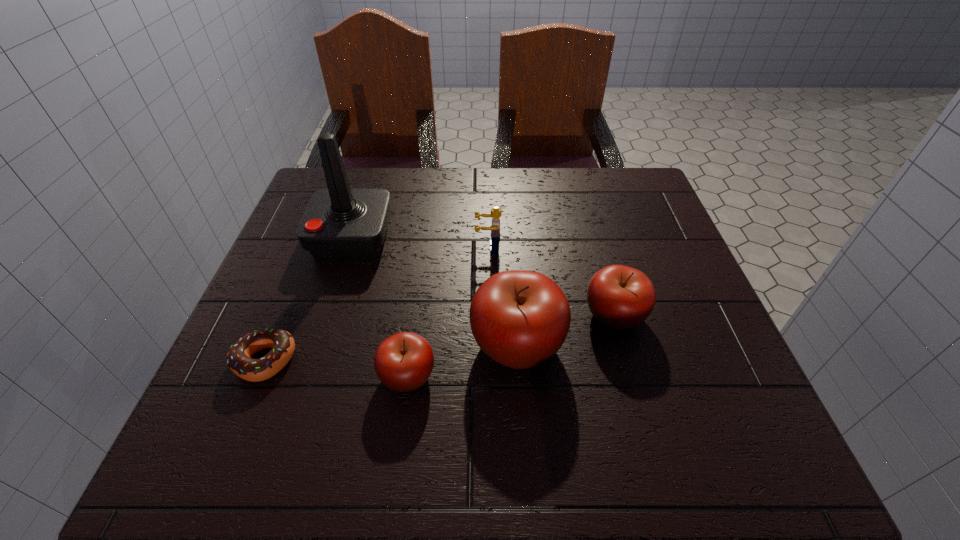
Image resolution: width=960 pixels, height=540 pixels. Find the location of `free space that is in between the doughnut and the joystick`. free space that is in between the doughnut and the joystick is located at coordinates pyautogui.click(x=308, y=299).

This screenshot has width=960, height=540. What are the coordinates of `free space between the second tallest object and the joystick` in the screenshot? It's located at pyautogui.click(x=434, y=290).

Locate an element on the screen. This screenshot has width=960, height=540. free space between the shortest object and the rightmost object is located at coordinates (440, 338).

Where is `vacant area that lies between the tallest object and the fifth shortest object`? This screenshot has width=960, height=540. vacant area that lies between the tallest object and the fifth shortest object is located at coordinates (434, 290).

Where is `vacant region between the shortest apple and the doughnut`? The image size is (960, 540). vacant region between the shortest apple and the doughnut is located at coordinates (336, 368).

Find the location of a particular element. free spot between the fifth shortest object and the joystick is located at coordinates (434, 290).

In order to click on free area in between the shortest apple and the shortest object in this screenshot , I will do `click(336, 368)`.

Identify the location of vacant point located between the doughnut and the second shortest apple. The width and height of the screenshot is (960, 540). (440, 338).

You are a GUI agent. You are given a task and a screenshot of the screen. Output one action in this format:
    pyautogui.click(x=<x>, y=<y>)
    Task: Click on the free space between the shortest object and the rightmost apple
    
    Given the screenshot: What is the action you would take?
    pyautogui.click(x=440, y=338)

Locate which object is the closest to the rightmost apple. Please provide its 2D coordinates. Your answer should be formatted as a tuple, i.e. [(x, y)], where the tuple contains the x and y coordinates of a point satisfying the conditions above.

[(520, 319)]